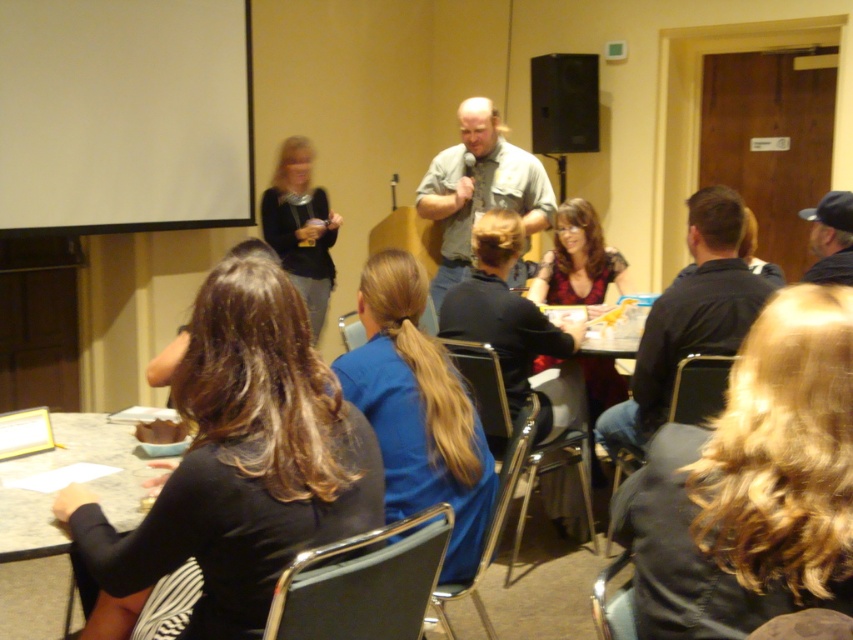
Question: Does black matte speaker at upper center have a smaller size compared to black leather cap at upper right?

Choices:
 (A) no
 (B) yes

Answer: (A)

Question: Which point is farther from the camera taking this photo?

Choices:
 (A) (300, 224)
 (B) (202, 28)
 (C) (38, 528)
 (D) (657, 307)

Answer: (A)

Question: Can you confirm if denim shirt at center is bigger than matte black sweater at center?

Choices:
 (A) no
 (B) yes

Answer: (B)

Question: Among these objects, which one is nearest to the camera?

Choices:
 (A) smooth white table at lower left
 (B) black matte speaker at upper center
 (C) white matte projection screen at upper left
 (D) black leather cap at upper right

Answer: (A)

Question: Can you confirm if black shirt at center is wider than denim shirt at center?

Choices:
 (A) yes
 (B) no

Answer: (B)

Question: Estimate the real-world distances between objects in this image. Which object is closer to the denim shirt at center?

Choices:
 (A) white matte projection screen at upper left
 (B) black shirt at center
 (C) smooth white table at lower left
 (D) black matte speaker at upper center

Answer: (D)